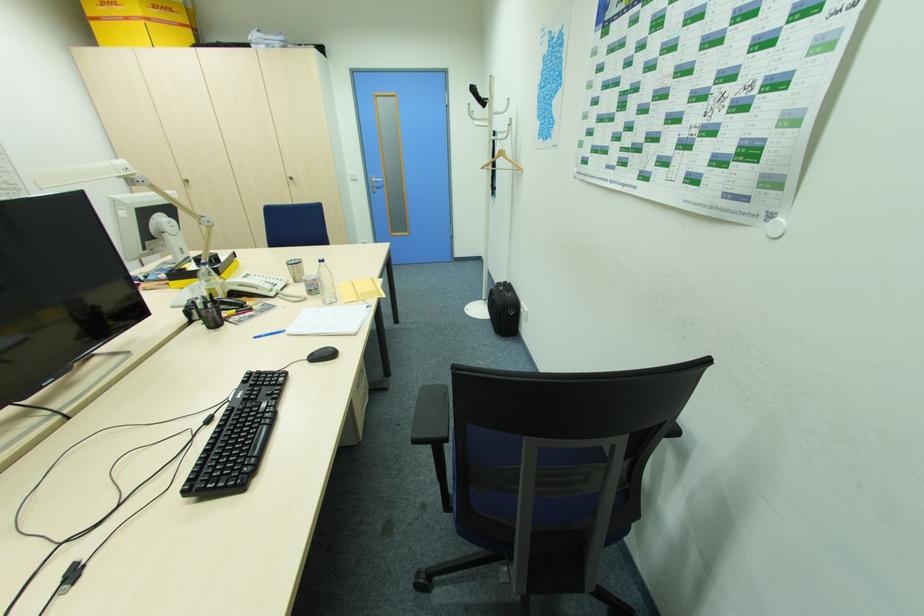
Find where to lift the white telephone handset. Please return your answer as a coordinate pair (x, y).

(253, 285)